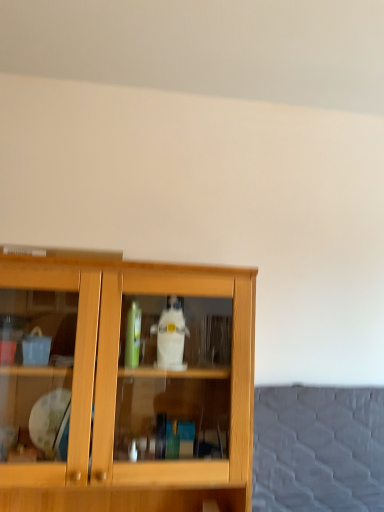
Describe the element at coordinates (123, 385) in the screenshot. I see `light wood cabinet at center` at that location.

Find the location of a particular element. light wood cabinet at center is located at coordinates (123, 385).

At what (x,y) coordinates should I click in order to perform the action: click on light wood cabinet at center. Please return your answer as a coordinate pair (x, y). This screenshot has width=384, height=512. Looking at the image, I should click on (123, 385).